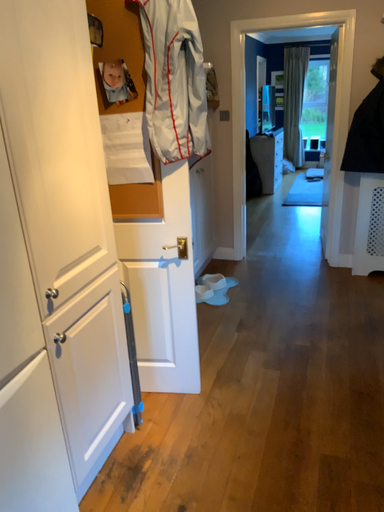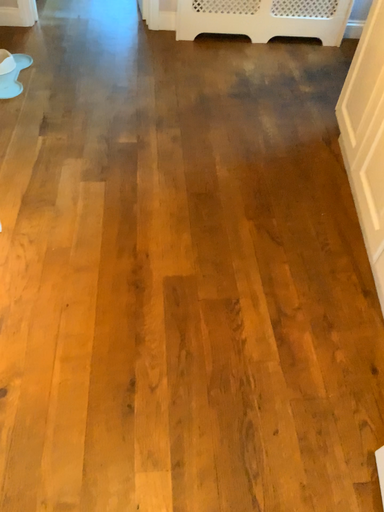
Question: How did the camera likely rotate when shooting the video?

Choices:
 (A) rotated left
 (B) rotated right

Answer: (B)